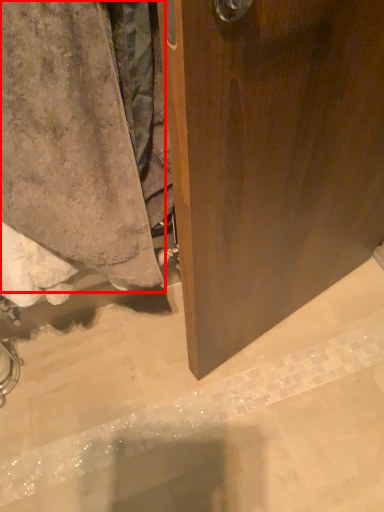
Question: Where is towel (annotated by the red box) located in relation to concrete in the image?

Choices:
 (A) left
 (B) right

Answer: (A)